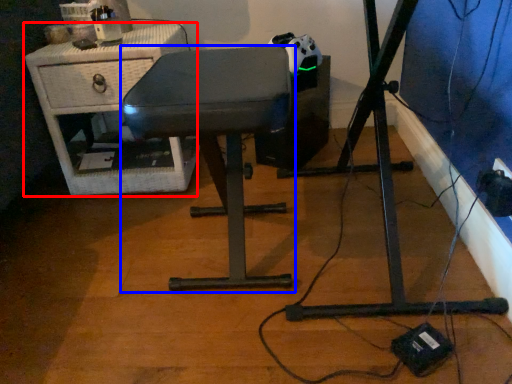
Question: Which object is closer to the camera taking this photo, furniture (highlighted by a red box) or furniture (highlighted by a blue box)?

Choices:
 (A) furniture
 (B) furniture

Answer: (B)